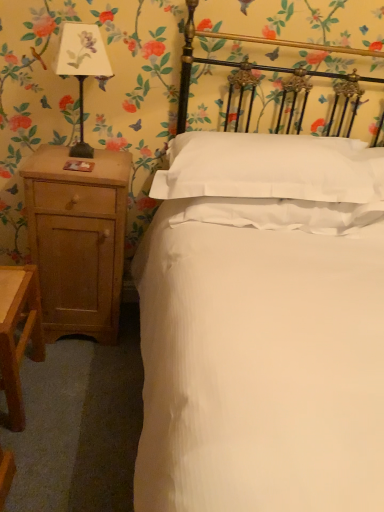
Question: Considering the relative sizes of matte black lampshade at left and white smooth pillow at center in the image provided, is matte black lampshade at left thinner than white smooth pillow at center?

Choices:
 (A) no
 (B) yes

Answer: (B)

Question: Could you tell me if matte black lampshade at left is turned towards white smooth pillow at center?

Choices:
 (A) no
 (B) yes

Answer: (A)

Question: Is matte black lampshade at left at the left side of white smooth pillow at center?

Choices:
 (A) yes
 (B) no

Answer: (A)

Question: Is matte black lampshade at left positioned with its back to white smooth pillow at center?

Choices:
 (A) no
 (B) yes

Answer: (A)

Question: Is matte black lampshade at left bigger than white smooth pillow at center?

Choices:
 (A) no
 (B) yes

Answer: (A)

Question: Do you think matte black lampshade at left is within light brown wood nightstand at left, or outside of it?

Choices:
 (A) inside
 (B) outside

Answer: (B)

Question: From a real-world perspective, is matte black lampshade at left positioned above or below light brown wood nightstand at left?

Choices:
 (A) above
 (B) below

Answer: (A)

Question: Considering the relative positions of matte black lampshade at left and light brown wood nightstand at left in the image provided, is matte black lampshade at left to the left or to the right of light brown wood nightstand at left?

Choices:
 (A) left
 (B) right

Answer: (B)

Question: From their relative heights in the image, would you say matte black lampshade at left is taller or shorter than light brown wood nightstand at left?

Choices:
 (A) short
 (B) tall

Answer: (A)

Question: Is light brown wood nightstand at left wider or thinner than white smooth pillow at center?

Choices:
 (A) thin
 (B) wide

Answer: (A)

Question: From their relative heights in the image, would you say light brown wood nightstand at left is taller or shorter than white smooth pillow at center?

Choices:
 (A) short
 (B) tall

Answer: (B)

Question: Based on their sizes in the image, would you say light brown wood nightstand at left is bigger or smaller than white smooth pillow at center?

Choices:
 (A) small
 (B) big

Answer: (A)

Question: From the image's perspective, relative to white smooth pillow at center, is light brown wood nightstand at left above or below?

Choices:
 (A) below
 (B) above

Answer: (A)

Question: Is white smooth pillow at center in front of or behind light brown wood nightstand at left in the image?

Choices:
 (A) behind
 (B) front

Answer: (B)

Question: Is point (288, 140) positioned closer to the camera than point (34, 225)?

Choices:
 (A) closer
 (B) farther

Answer: (A)